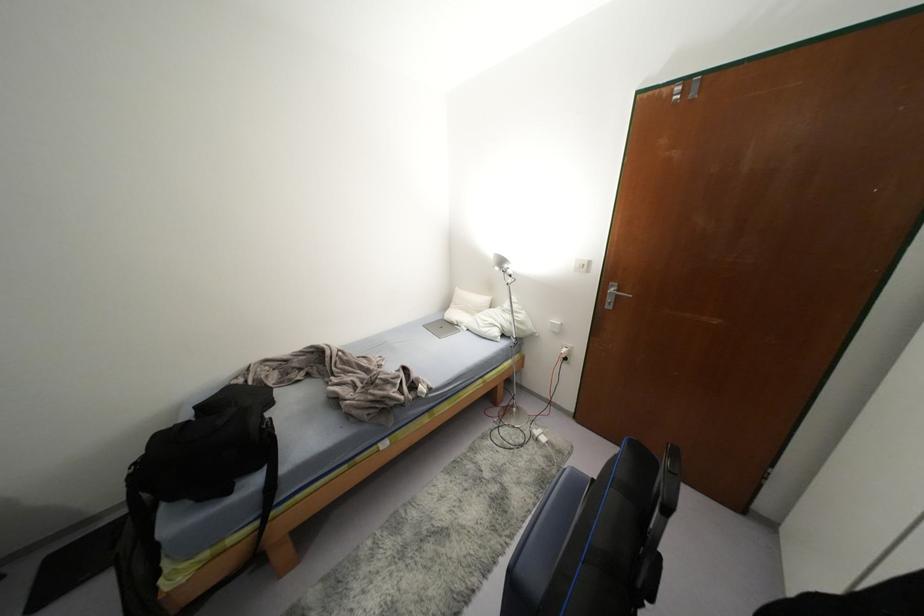
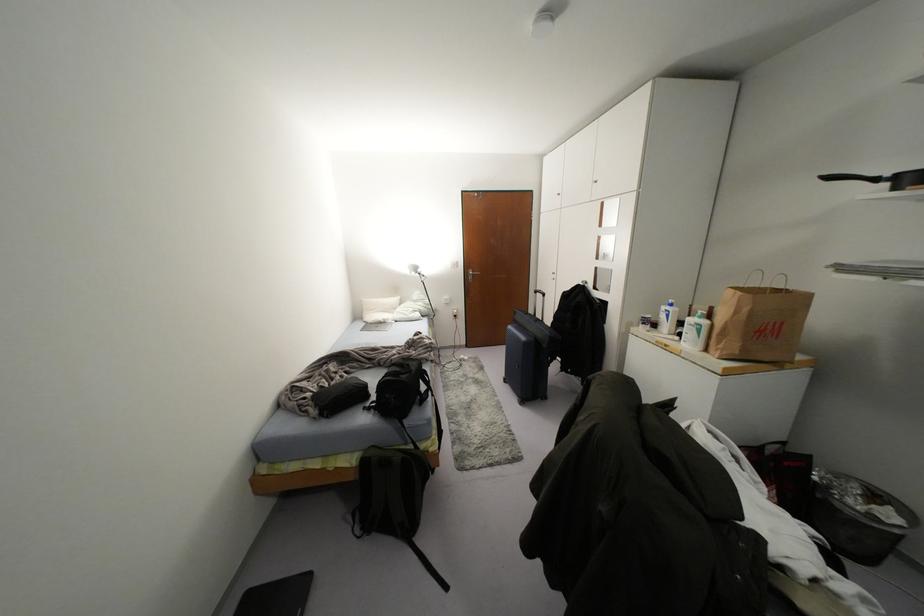
Locate, in the second image, the point that corresponds to (x=484, y=299) in the first image.

(394, 299)